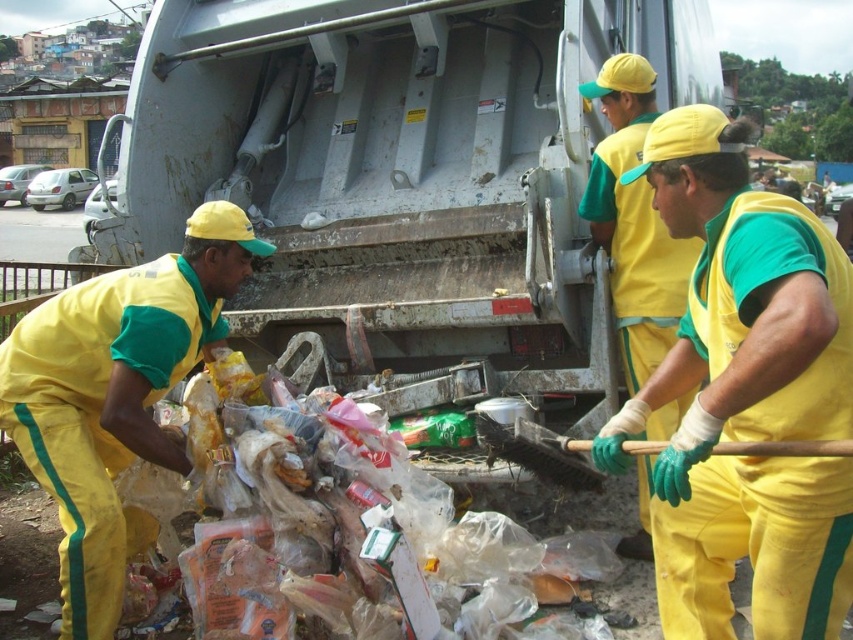
Which is above, metallic gray garbage truck at center or yellow fabric gloves at center?

metallic gray garbage truck at center is above.

Which is behind, point (358, 182) or point (602, 236)?

The point (358, 182) is more distant.

The width and height of the screenshot is (853, 640). What are the coordinates of `metallic gray garbage truck at center` in the screenshot? It's located at (401, 179).

Which is in front, point (51, 369) or point (625, 376)?

Point (51, 369)

Does yellow/green fabric uniform at lower left have a greater height compared to yellow fabric gloves at center?

Incorrect, yellow/green fabric uniform at lower left's height is not larger of yellow fabric gloves at center's.

Find the location of a particular element. This screenshot has height=640, width=853. yellow/green fabric uniform at lower left is located at coordinates (108, 406).

The image size is (853, 640). Describe the element at coordinates (401, 179) in the screenshot. I see `metallic gray garbage truck at center` at that location.

Find the location of `metallic gray garbage truck at center`. metallic gray garbage truck at center is located at coordinates (401, 179).

Between point (201, 177) and point (128, 438), which one is positioned behind?

Positioned behind is point (201, 177).

The image size is (853, 640). What are the coordinates of `metallic gray garbage truck at center` in the screenshot? It's located at (401, 179).